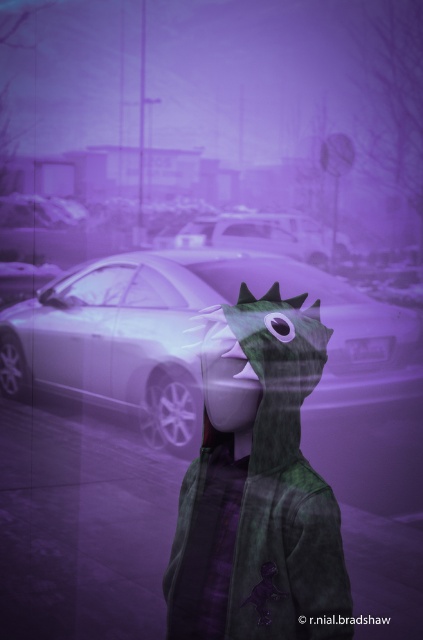
Is green matte dragon mask at center smaller than shiny silver car at center?

Correct, green matte dragon mask at center occupies less space than shiny silver car at center.

Identify the location of green matte dragon mask at center. (257, 486).

Who is more distant from viewer, (294, 364) or (118, 388)?

Positioned behind is point (118, 388).

The width and height of the screenshot is (423, 640). What are the coordinates of `green matte dragon mask at center` in the screenshot? It's located at (257, 486).